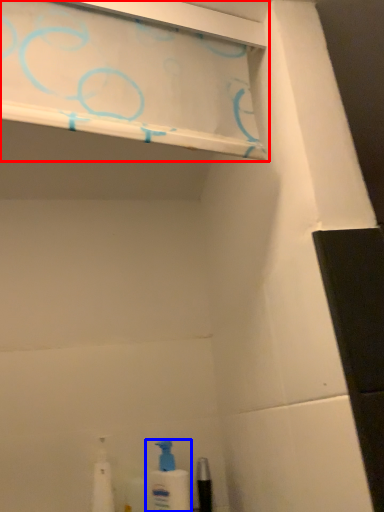
Question: Which point is further to the camera, shelf (highlighted by a red box) or cleaning product (highlighted by a blue box)?

Choices:
 (A) shelf
 (B) cleaning product

Answer: (B)